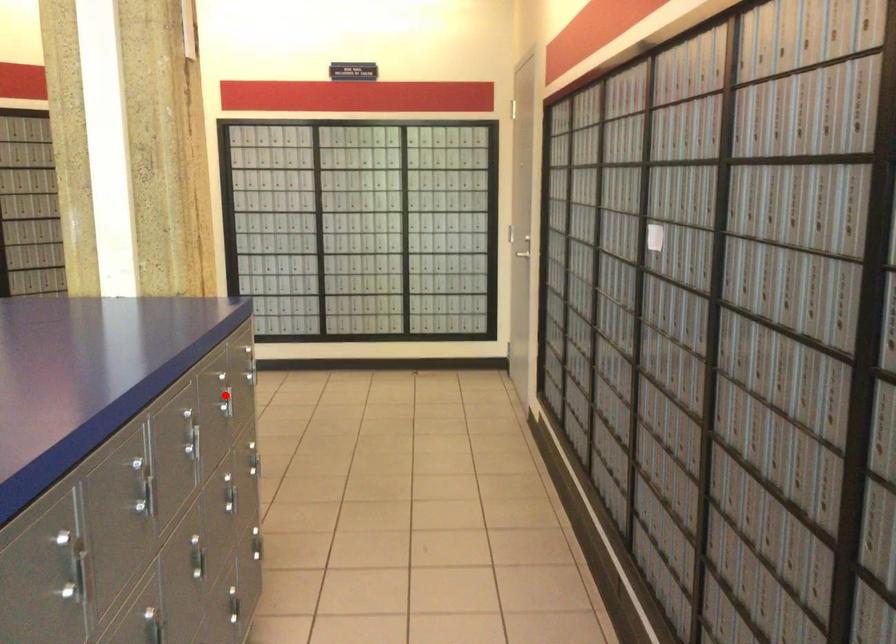
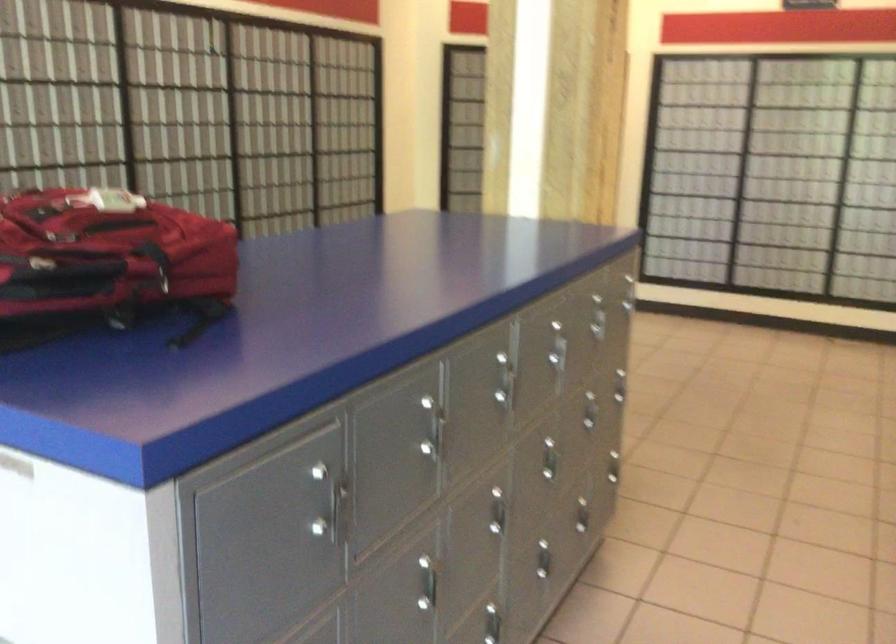
Find the pixel in the second image that matches the highlighted location in the first image.

(601, 317)